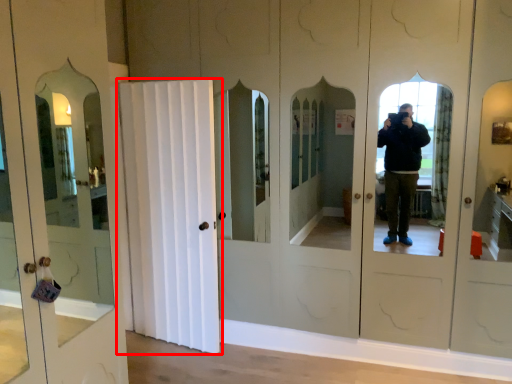
Question: From the image's perspective, what is the correct spatial relationship of door (annotated by the red box) in relation to door?

Choices:
 (A) above
 (B) below

Answer: (B)